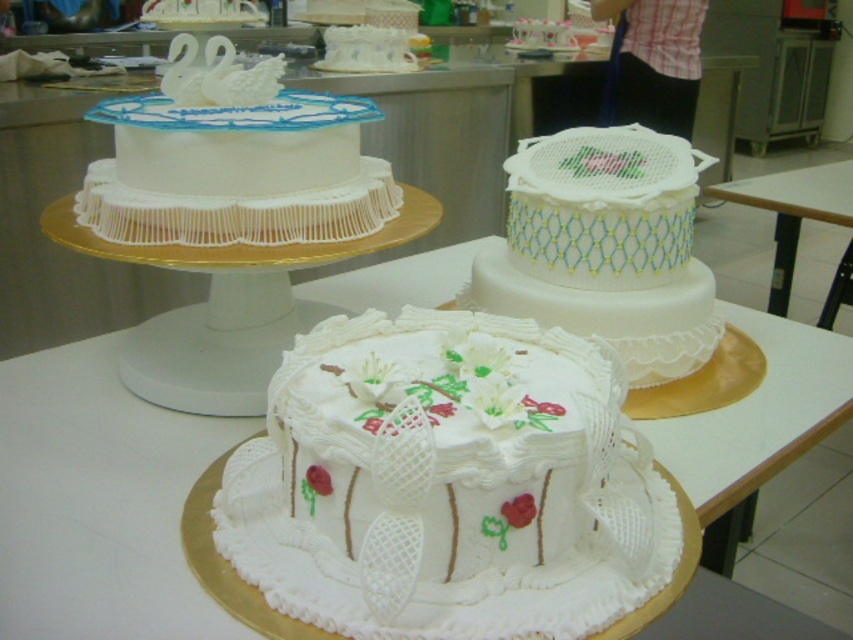
You are a customer at the bakery and want to buy the smallest cake. Which cake should you choose between the white fondant cake at center and the white fondant cake at upper left?

The white fondant cake at center is smaller than the white fondant cake at upper left, so you should choose the white fondant cake at center.

Consider the image. You are a customer at the bakery and want to know which cake is closer to you. The white fondant cake at center and the white lace cake at center are both on display. Which one is nearer to your viewpoint?

The white fondant cake at center is positioned under the white lace cake at center, so the white lace cake at center is closer to you.

You are a customer standing in front of the table with the three cakes. You want to take a photo of the cake at point (x=579, y=452) and the cake at point (x=354, y=204). Which cake should you focus on first to ensure both are in focus?

You should focus on the cake at point (x=354, y=204) first because it is further away from you than the cake at point (x=579, y=452). By focusing on the further cake, both will be in focus due to the depth of field.